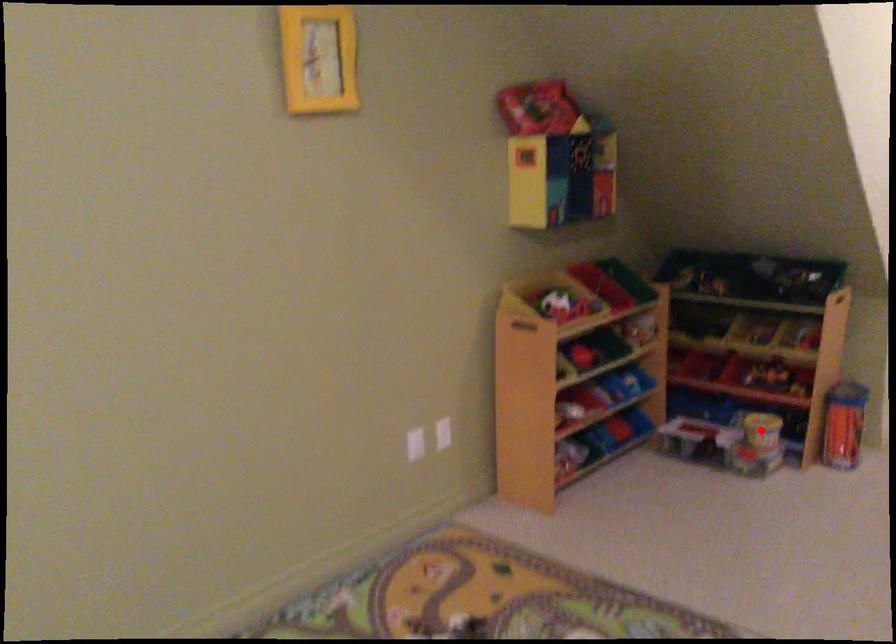
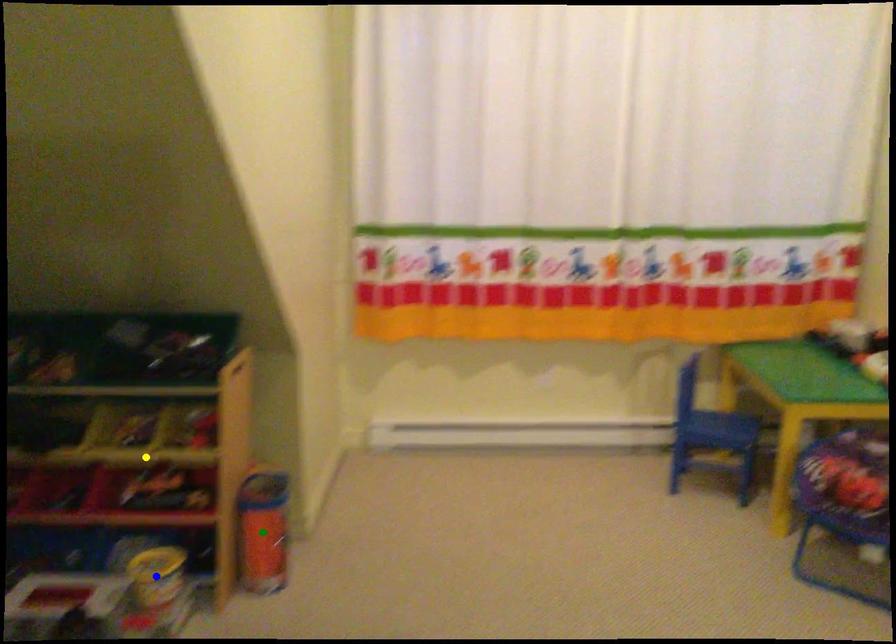
Question: I am providing you with two images of the same scene from different viewpoints. A red point is marked on the first image. You are given multiple points on the second image. Which mark in image 2 goes with the point in image 1?

Choices:
 (A) yellow point
 (B) green point
 (C) blue point

Answer: (C)